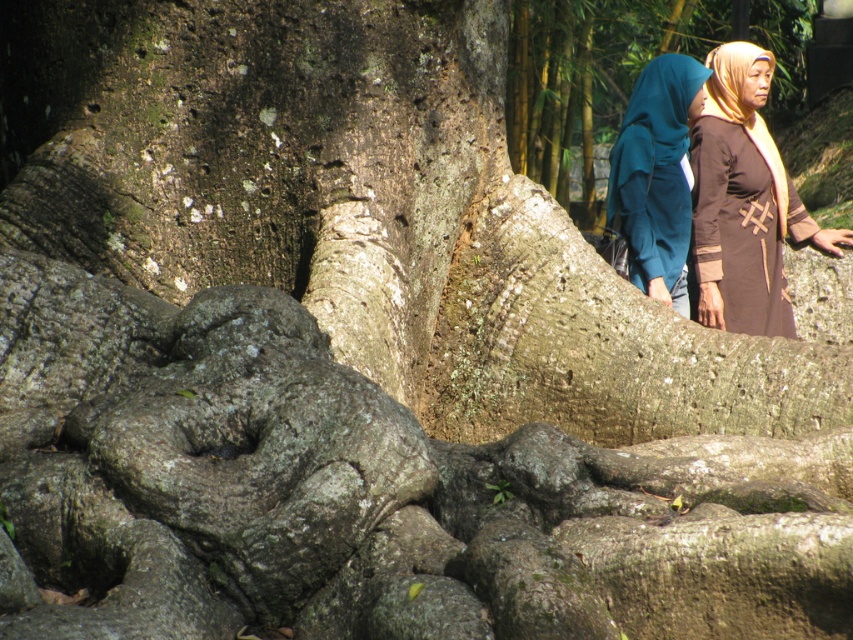
Which is above, brown matte robe at right or teal fabric hijab at upper right?

teal fabric hijab at upper right is higher up.

Is brown matte robe at right wider than teal fabric hijab at upper right?

Indeed, brown matte robe at right has a greater width compared to teal fabric hijab at upper right.

Between point (746, 232) and point (646, 145), which one is positioned in front?

Point (646, 145) is more forward.

The image size is (853, 640). What are the coordinates of `brown matte robe at right` in the screenshot? It's located at (738, 232).

Which is in front, point (733, 141) or point (744, 113)?

Positioned in front is point (733, 141).

This screenshot has height=640, width=853. What are the coordinates of `brown matte robe at right` in the screenshot? It's located at (738, 232).

Where is `brown matte robe at right`? brown matte robe at right is located at coordinates (738, 232).

Can you confirm if teal fabric hijab at upper right is positioned below brown woven shawl at upper right?

Indeed, teal fabric hijab at upper right is positioned under brown woven shawl at upper right.

Which is more to the right, teal fabric hijab at upper right or brown woven shawl at upper right?

From the viewer's perspective, brown woven shawl at upper right appears more on the right side.

This screenshot has width=853, height=640. What do you see at coordinates (656, 177) in the screenshot?
I see `teal fabric hijab at upper right` at bounding box center [656, 177].

Where is `teal fabric hijab at upper right`? The height and width of the screenshot is (640, 853). teal fabric hijab at upper right is located at coordinates (656, 177).